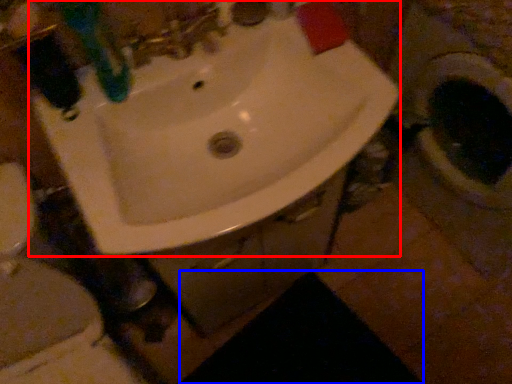
Question: Which object appears farthest to the camera in this image, sink (highlighted by a red box) or dark (highlighted by a blue box)?

Choices:
 (A) sink
 (B) dark

Answer: (B)